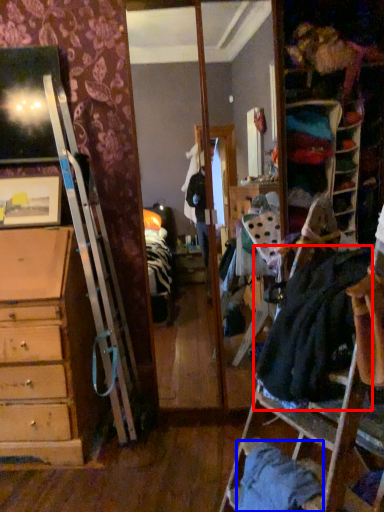
Question: Among these objects, which one is farthest to the camera, clothing (highlighted by a red box) or clothing (highlighted by a blue box)?

Choices:
 (A) clothing
 (B) clothing

Answer: (B)